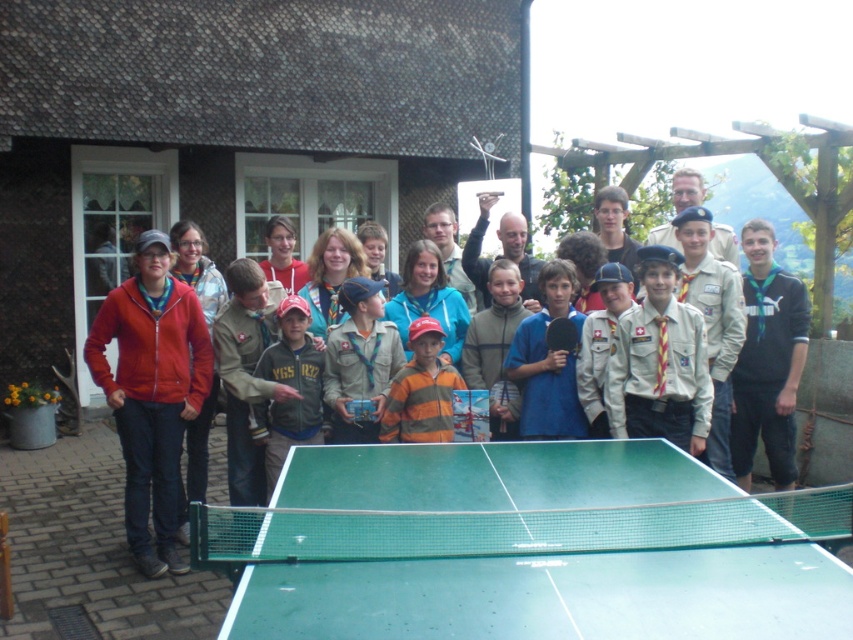
Does khaki uniform at center appear on the right side of striped fleece jacket at center?

Incorrect, khaki uniform at center is not on the right side of striped fleece jacket at center.

The width and height of the screenshot is (853, 640). Find the location of `khaki uniform at center`. khaki uniform at center is located at coordinates (358, 358).

Which is in front, point (329, 348) or point (416, 323)?

Point (416, 323) is more forward.

Locate an element on the screen. Image resolution: width=853 pixels, height=640 pixels. khaki uniform at center is located at coordinates (358, 358).

Does point (376, 404) come farther from viewer compared to point (373, 406)?

No, (376, 404) is closer to viewer.

Describe the element at coordinates (358, 358) in the screenshot. I see `khaki uniform at center` at that location.

Where is `khaki uniform at center`? khaki uniform at center is located at coordinates (358, 358).

Locate an element on the screen. Image resolution: width=853 pixels, height=640 pixels. khaki uniform at center is located at coordinates [x=358, y=358].

Who is higher up, khaki uniform at center or green rubber table tennis racket at center?

green rubber table tennis racket at center is higher up.

Which is below, khaki uniform at center or green rubber table tennis racket at center?

khaki uniform at center is lower down.

Is point (364, 312) closer to camera compared to point (577, 330)?

No.

You are a GUI agent. You are given a task and a screenshot of the screen. Output one action in this format:
    pyautogui.click(x=<x>, y=<y>)
    Task: Click on the khaki uniform at center
    The width and height of the screenshot is (853, 640).
    Given the screenshot: What is the action you would take?
    pyautogui.click(x=358, y=358)